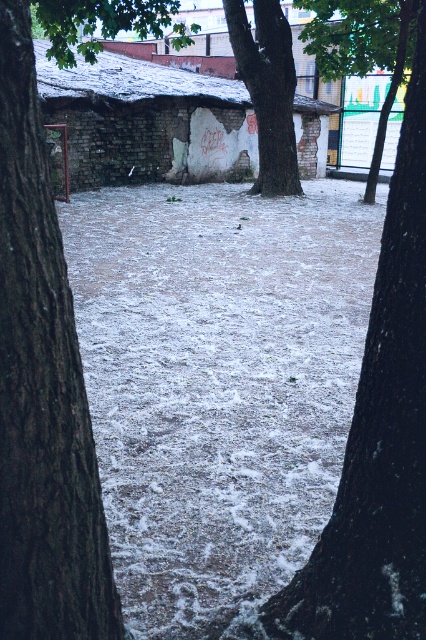
You are standing in the snowy park and want to take a photo of both the smooth brown tree trunk at center and the green leafy tree at upper center. Which tree should you focus on first to ensure both are in the frame?

You should focus on the smooth brown tree trunk at center first because it is closer to the viewer than the green leafy tree at upper center, ensuring both are in the frame.